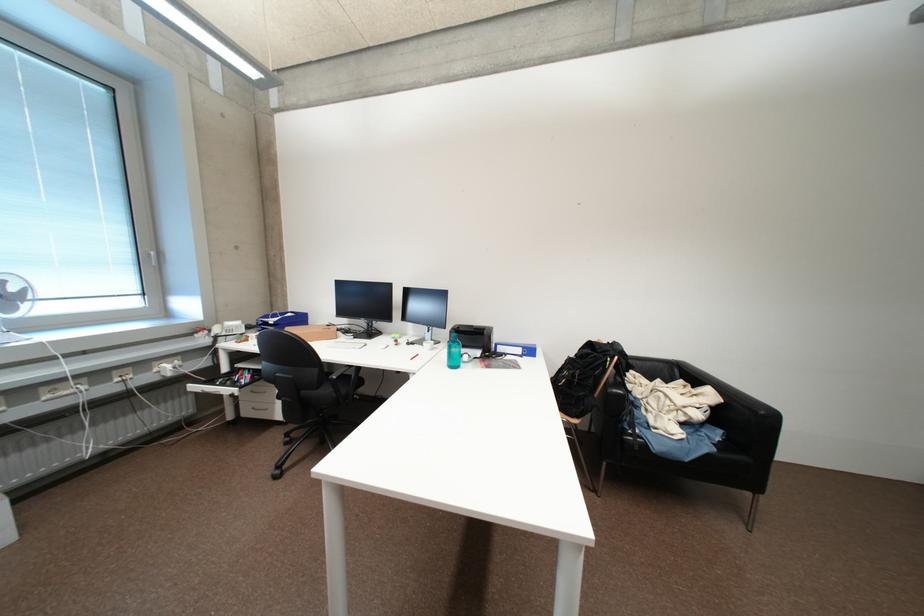
The width and height of the screenshot is (924, 616). Describe the element at coordinates (360, 406) in the screenshot. I see `the chair sitting surface` at that location.